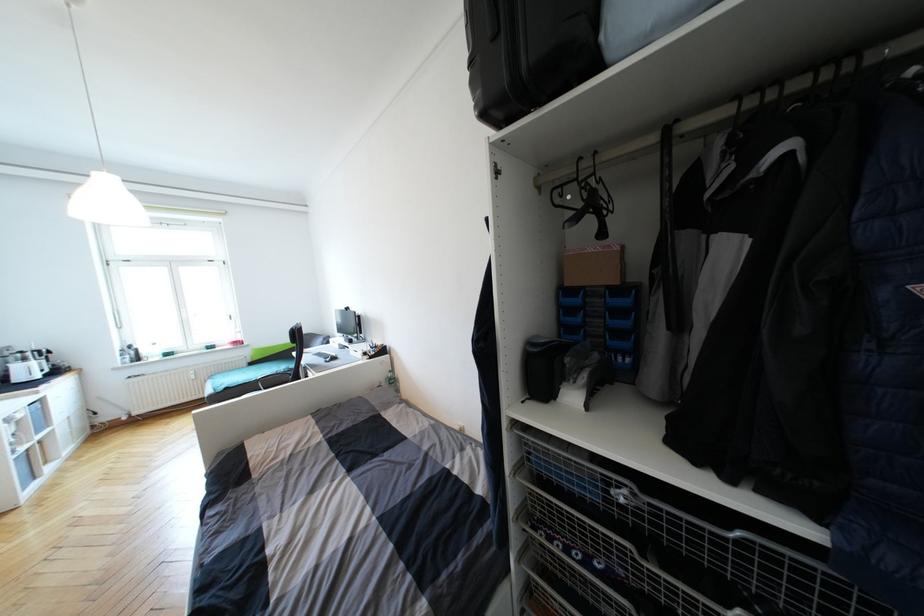
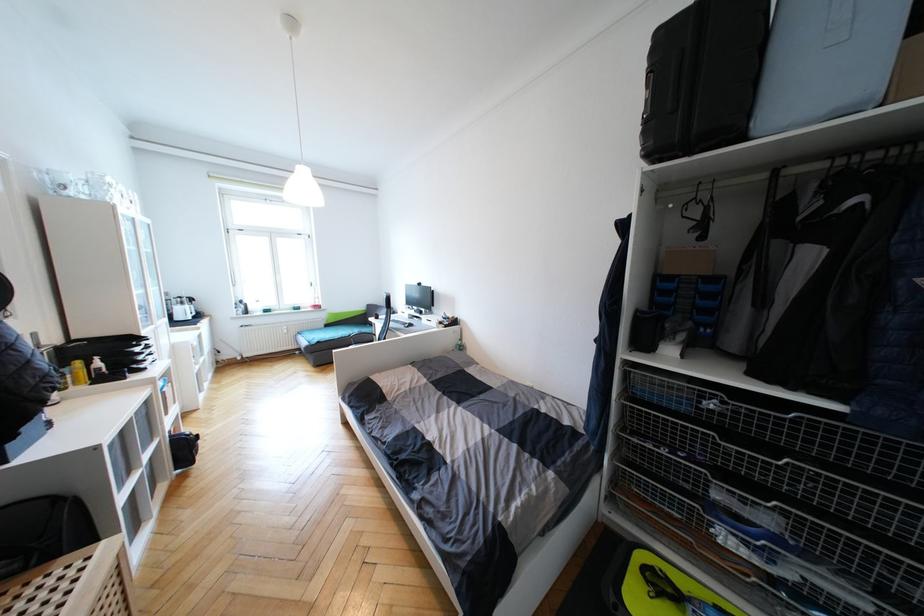
Find the pixel in the second image that matches (x=28, y=361) in the first image.

(186, 305)